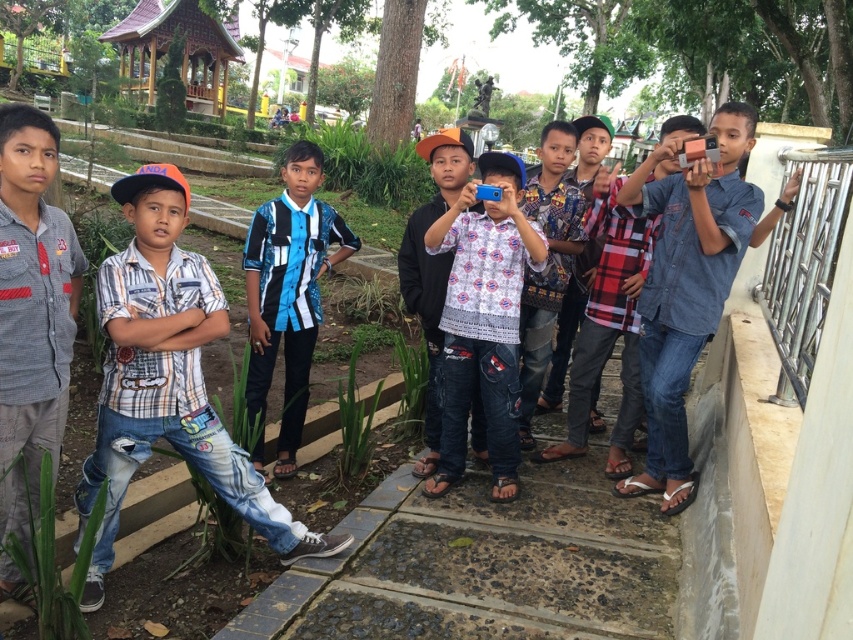
You are a photographer trying to capture a group photo of the boys. You want to ensure that both the gray cotton shirt at left and the blue and white striped shirt at center are visible in the frame. Which boy should you position closer to the front to avoid blocking the view of the other?

Since the gray cotton shirt at left is not as tall as the blue and white striped shirt at center, you should position the gray cotton shirt at left closer to the front to avoid blocking the view of the taller blue and white striped shirt at center.

You are standing at the point marked as point [68,314] in the image. The gazebo with a red roof is directly behind you. If you walk straight ahead, will you eventually see the building partially hidden by trees?

The distance of point [68,314] from viewer is 8.93 feet. Since the gazebo is behind you and the building is partially visible behind trees, walking straight ahead might allow you to see the building as you move forward, but the trees could still obstruct the view. However, the exact visibility depends on the path and tree density, which aren